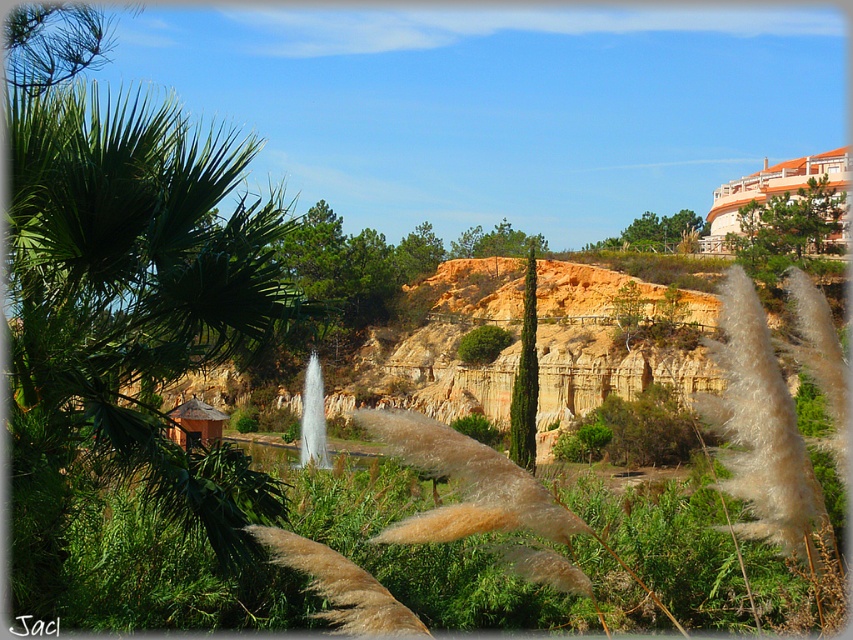
Is orange clay hillside at center shorter than green matte tree at center?

Yes.

Is point (445, 292) positioned in front of point (425, 264)?

Yes, point (445, 292) is closer to viewer.

Is point (614, 300) positioned behind point (397, 280)?

No, it is in front of (397, 280).

Where is `orange clay hillside at center`? orange clay hillside at center is located at coordinates (614, 296).

In the scene shown: Does orange clay hillside at center have a greater height compared to green glossy cypress at center?

In fact, orange clay hillside at center may be shorter than green glossy cypress at center.

What are the coordinates of `orange clay hillside at center` in the screenshot? It's located at (614, 296).

Does point (457, 262) come behind point (514, 460)?

Yes, point (457, 262) is farther from viewer.

The height and width of the screenshot is (640, 853). What are the coordinates of `orange clay hillside at center` in the screenshot? It's located at (614, 296).

Describe the element at coordinates (614, 296) in the screenshot. I see `orange clay hillside at center` at that location.

Is point (505, 300) closer to viewer compared to point (821, 184)?

That is False.

Which is behind, point (430, 292) or point (732, 241)?

Positioned behind is point (430, 292).

The image size is (853, 640). Find the location of `orange clay hillside at center`. orange clay hillside at center is located at coordinates (614, 296).